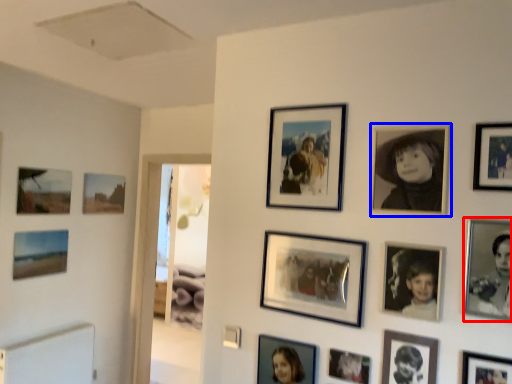
Question: Which object is closer to the camera taking this photo, picture frame (highlighted by a red box) or picture frame (highlighted by a blue box)?

Choices:
 (A) picture frame
 (B) picture frame

Answer: (A)